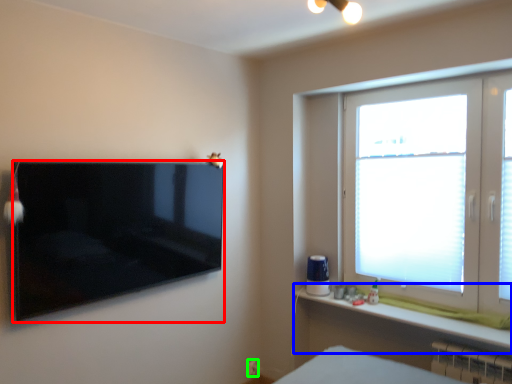
Question: Considering the real-world distances, which object is closest to television (highlighted by a red box)? window sill (highlighted by a blue box) or electric outlet (highlighted by a green box).

Choices:
 (A) window sill
 (B) electric outlet

Answer: (A)